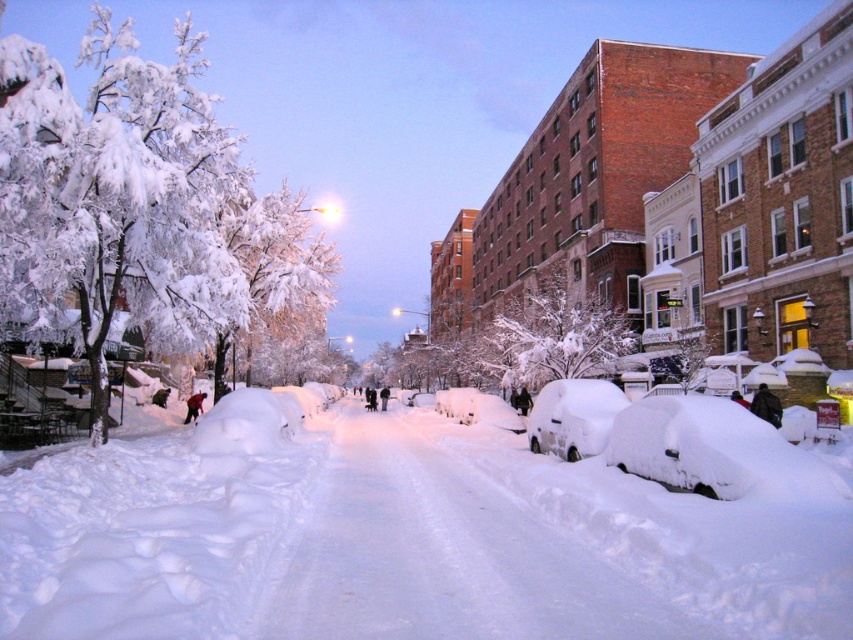
Does point (682, 493) come farther from viewer compared to point (509, 385)?

That is False.

Between white fluffy snow at center and white frosty tree at center, which one has more height?

With more height is white frosty tree at center.

Find the location of a particular element. Image resolution: width=853 pixels, height=640 pixels. white fluffy snow at center is located at coordinates (412, 534).

Can you confirm if white frosty tree at upper center is smaller than white fluffy car at center?

No, white frosty tree at upper center is not smaller than white fluffy car at center.

Can you confirm if white frosty tree at upper center is positioned to the right of white fluffy car at center?

In fact, white frosty tree at upper center is to the left of white fluffy car at center.

Between point (230, 342) and point (581, 394), which one is positioned behind?

Point (230, 342)

Find the location of a particular element. white frosty tree at upper center is located at coordinates (276, 284).

Can you confirm if white fluffy snow at center is shorter than white fluffy car at center?

In fact, white fluffy snow at center may be taller than white fluffy car at center.

Which is in front, point (762, 634) or point (604, 436)?

Point (762, 634) is in front.

The image size is (853, 640). In order to click on white fluffy snow at center in this screenshot , I will do `click(412, 534)`.